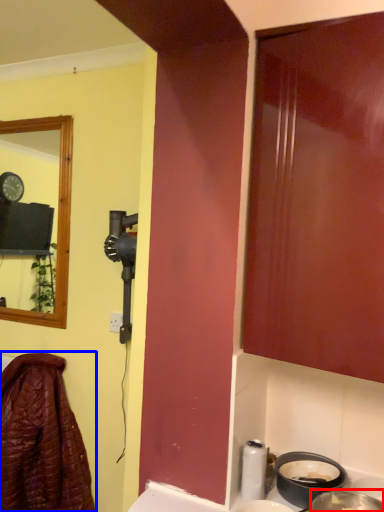
Question: Which object is closer to the camera taking this photo, basin (highlighted by a red box) or laundry (highlighted by a blue box)?

Choices:
 (A) basin
 (B) laundry

Answer: (A)